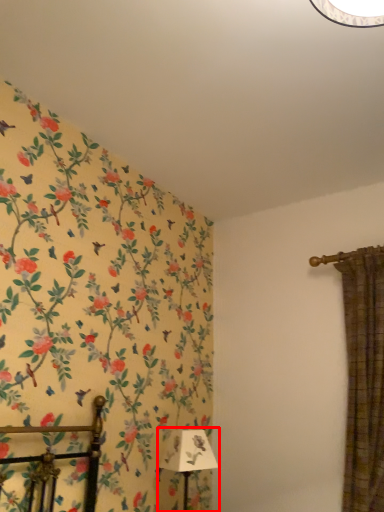
Question: Observing the image, what is the correct spatial positioning of table lamp (annotated by the red box) in reference to curtain?

Choices:
 (A) left
 (B) right

Answer: (A)